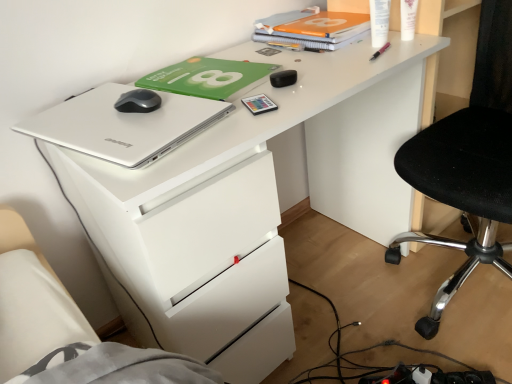
This screenshot has height=384, width=512. Find the location of `vacant space to the left of black matte earbuds at center, the second stationery ordered from the bottom`. vacant space to the left of black matte earbuds at center, the second stationery ordered from the bottom is located at coordinates (233, 86).